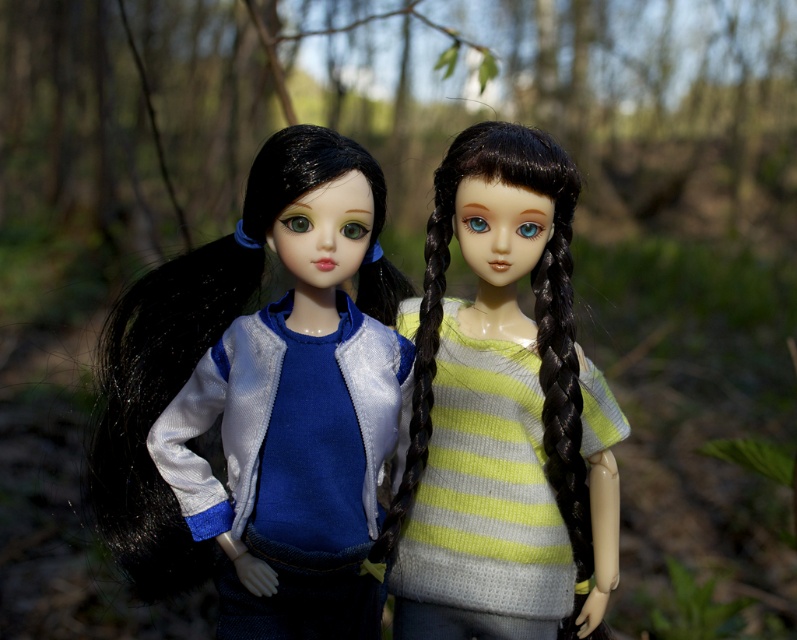
You are a photographer setting up a shot in the forest scene with two dolls. You need to place a knitted yellow green striped sweater exactly at point (501,413). Where should you position the sweater relative to the dolls?

The knitted yellow green striped sweater at center should be placed at point (501,413), which is the center position between the two dolls.